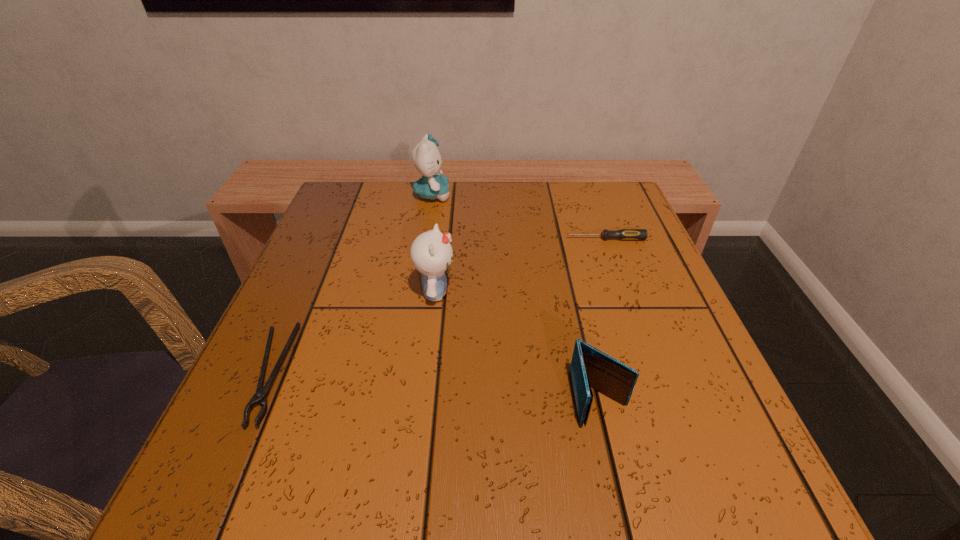
Where is `vacant region between the third farthest object and the leftmost object`? The height and width of the screenshot is (540, 960). vacant region between the third farthest object and the leftmost object is located at coordinates (351, 333).

At what (x,y) coordinates should I click in order to perform the action: click on free spot between the fourth nearest object and the leftmost object. Please return your answer as a coordinate pair (x, y). This screenshot has width=960, height=540. Looking at the image, I should click on (436, 307).

Identify the location of vacant space in between the wallet and the farthest object. (516, 297).

Find the location of a particular element. free spot between the fourth tallest object and the wallet is located at coordinates (603, 319).

At what (x,y) coordinates should I click in order to perform the action: click on free space between the wallet and the leftmost object. Please return your answer as a coordinate pair (x, y). Looking at the image, I should click on (433, 387).

Image resolution: width=960 pixels, height=540 pixels. I want to click on empty space that is in between the third tallest object and the leftmost object, so click(x=433, y=387).

Find the location of a particular element. The width and height of the screenshot is (960, 540). the second closest object to the farthest object is located at coordinates (624, 234).

Point out which object is positioned as the third nearest to the third nearest object. Please provide its 2D coordinates. Your answer should be formatted as a tuple, i.e. [(x, y)], where the tuple contains the x and y coordinates of a point satisfying the conditions above.

[(433, 185)]

At what (x,y) coordinates should I click in order to perform the action: click on vacant position in the image that satisfies the following two spatial constraints: 1. insert the fourth tallest object into a screw head; 2. on the exterior surface of the third shortest object. Please return your answer as a coordinate pair (x, y). Image resolution: width=960 pixels, height=540 pixels. Looking at the image, I should click on pos(663,399).

This screenshot has height=540, width=960. What are the coordinates of `vacant space that satisfies the following two spatial constraints: 1. insert the screwdriver into a screw head; 2. on the exterior surface of the third shortest object` in the screenshot? It's located at (663, 399).